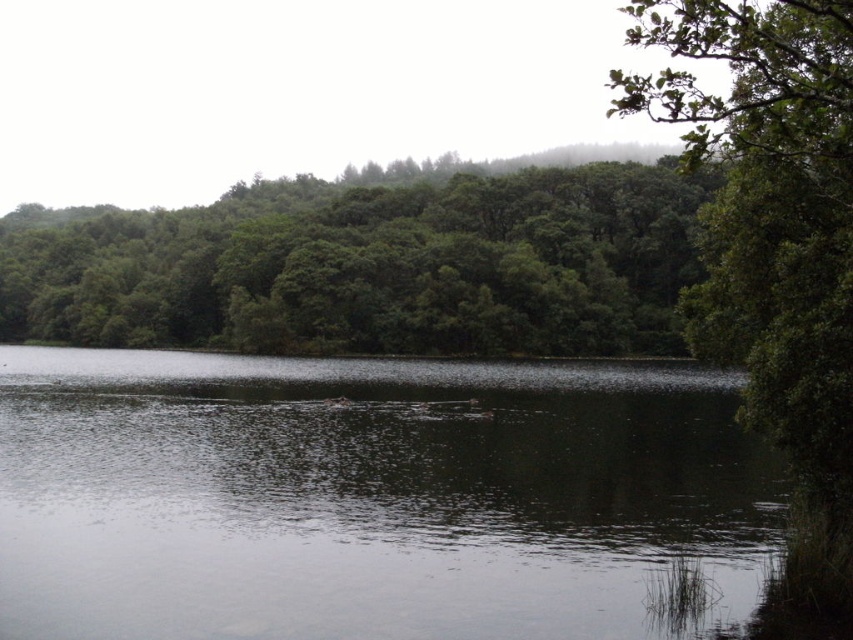
Question: Can you confirm if dark reflective water at center is wider than green leafy trees at center?

Choices:
 (A) yes
 (B) no

Answer: (B)

Question: Which of the following is the closest to the observer?

Choices:
 (A) (508, 440)
 (B) (363, 221)

Answer: (A)

Question: Where is dark reflective water at center located in relation to green leafy trees at center in the image?

Choices:
 (A) right
 (B) left

Answer: (A)

Question: Is dark reflective water at center bigger than green leafy trees at center?

Choices:
 (A) no
 (B) yes

Answer: (A)